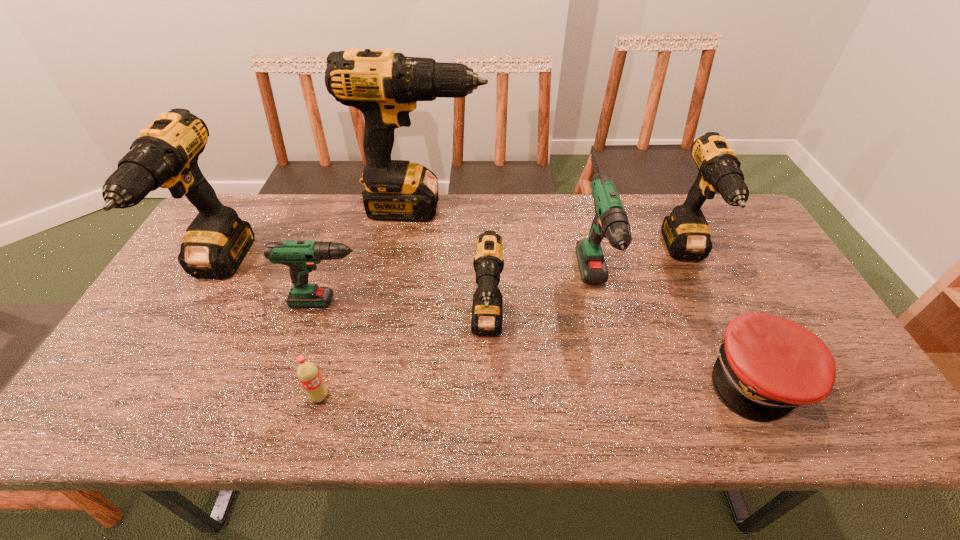
Where is `free area in between the fifth drill from left to right and the smaller green drill`? free area in between the fifth drill from left to right and the smaller green drill is located at coordinates (466, 296).

Where is `unoccupied position between the leftmost drill and the smallest black drill`? This screenshot has width=960, height=540. unoccupied position between the leftmost drill and the smallest black drill is located at coordinates (352, 300).

The height and width of the screenshot is (540, 960). Identify the location of vacant space that's between the second smallest black drill and the smaller green drill. (512, 278).

Where is `vacant space that's between the farthest object and the second biggest black drill`? vacant space that's between the farthest object and the second biggest black drill is located at coordinates 320,239.

The width and height of the screenshot is (960, 540). Identify the location of object that is the fourth closest one to the seventh shortest object. (487, 309).

Select which object appears as the seventh closest to the smallest black drill. Please provide its 2D coordinates. Your answer should be formatted as a tuple, i.e. [(x, y)], where the tuple contains the x and y coordinates of a point satisfying the conditions above.

[(165, 155)]

Identify which drill is the second nearest to the third shortest object. Please provide its 2D coordinates. Your answer should be formatted as a tuple, i.e. [(x, y)], where the tuple contains the x and y coordinates of a point satisfying the conditions above.

[(487, 309)]

Locate which drill ranks third in proximity to the leftmost drill. Please provide its 2D coordinates. Your answer should be formatted as a tuple, i.e. [(x, y)], where the tuple contains the x and y coordinates of a point satisfying the conditions above.

[(487, 309)]

Locate an element on the screen. The height and width of the screenshot is (540, 960). the second closest black drill relative to the shortest object is located at coordinates (487, 309).

Point out which black drill is positioned as the second nearest to the red cap. Please provide its 2D coordinates. Your answer should be formatted as a tuple, i.e. [(x, y)], where the tuple contains the x and y coordinates of a point satisfying the conditions above.

[(487, 309)]